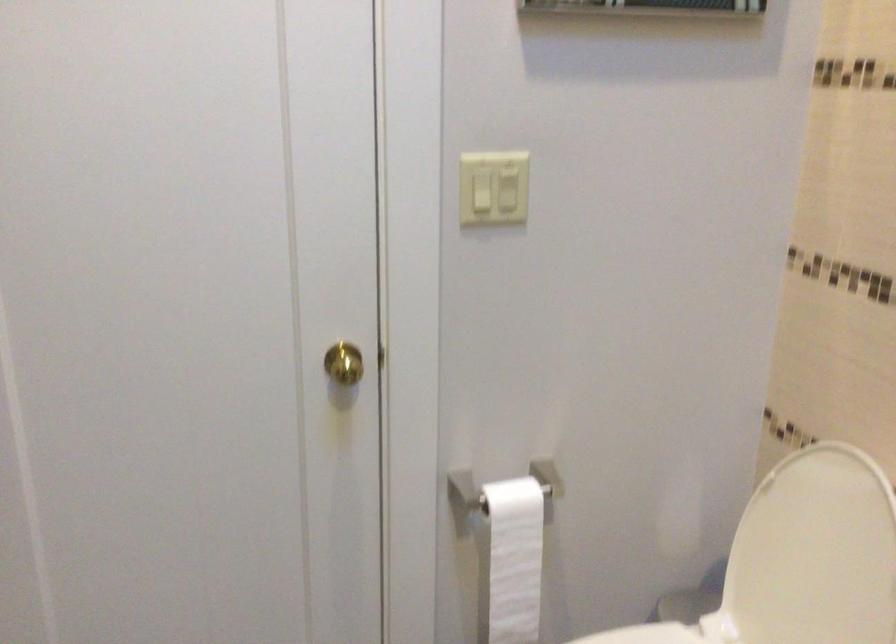
The location [513,560] corresponds to which object?

It corresponds to the toilet paper roll in the image.